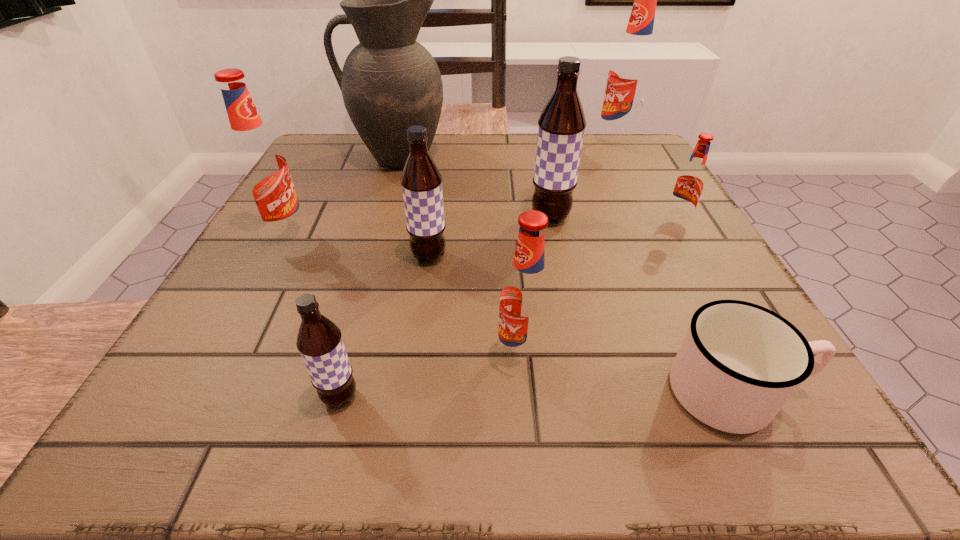
Find the location of `mug located in the right edge section of the desktop`. mug located in the right edge section of the desktop is located at coordinates (739, 363).

Where is `object positioned at the far left corner`? object positioned at the far left corner is located at coordinates (389, 82).

Locate an element on the screen. The height and width of the screenshot is (540, 960). object located at the far right corner is located at coordinates (631, 70).

Where is `object present at the near right corner`? This screenshot has width=960, height=540. object present at the near right corner is located at coordinates (739, 363).

The image size is (960, 540). Identify the location of vacant space at the far edge of the desktop. (451, 173).

This screenshot has height=540, width=960. In the image, there is a desktop. In order to click on free region at the near edge in this screenshot , I will do `click(554, 400)`.

Find the location of `free space at the left edge of the desktop`. free space at the left edge of the desktop is located at coordinates (305, 183).

This screenshot has height=540, width=960. What are the coordinates of `vacant area at the right edge` in the screenshot? It's located at (695, 237).

I want to click on free space at the far left corner of the desktop, so click(x=331, y=145).

At what (x,y) coordinates should I click in order to perform the action: click on free region at the far right corner of the desktop. Please return your answer as a coordinate pair (x, y). Image resolution: width=960 pixels, height=540 pixels. Looking at the image, I should click on (661, 173).